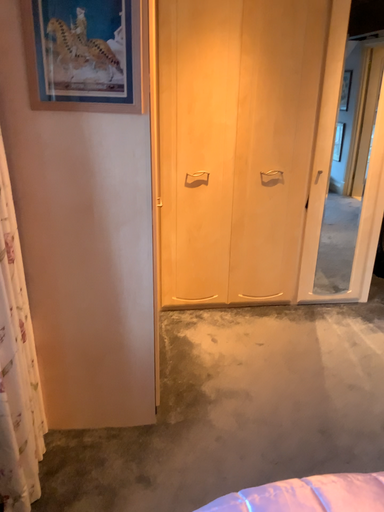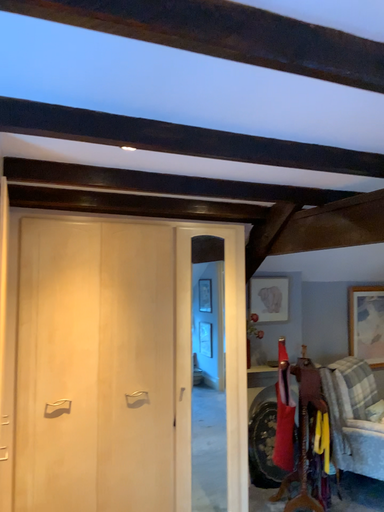
Question: Which way did the camera rotate in the video?

Choices:
 (A) rotated right
 (B) rotated left

Answer: (A)